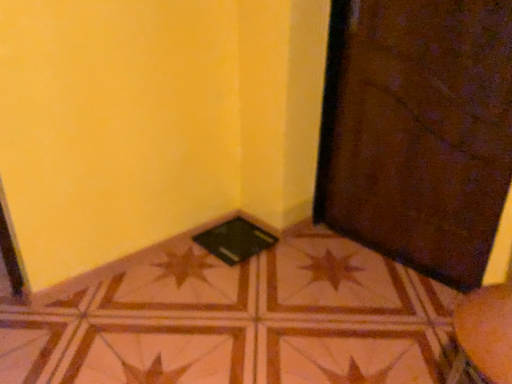
Question: Considering the relative sizes of brown glossy tile at center and black matte pad at lower center in the image provided, is brown glossy tile at center shorter than black matte pad at lower center?

Choices:
 (A) no
 (B) yes

Answer: (A)

Question: From a real-world perspective, is brown glossy tile at center on black matte pad at lower center?

Choices:
 (A) yes
 (B) no

Answer: (B)

Question: Does brown glossy tile at center have a smaller size compared to black matte pad at lower center?

Choices:
 (A) yes
 (B) no

Answer: (B)

Question: Considering the relative sizes of brown glossy tile at center and black matte pad at lower center in the image provided, is brown glossy tile at center bigger than black matte pad at lower center?

Choices:
 (A) yes
 (B) no

Answer: (A)

Question: From the image's perspective, is brown glossy tile at center beneath black matte pad at lower center?

Choices:
 (A) no
 (B) yes

Answer: (B)

Question: Based on their positions, is brown textured door at lower right located to the left or right of black matte pad at lower center?

Choices:
 (A) left
 (B) right

Answer: (B)

Question: From the image's perspective, is brown textured door at lower right above or below black matte pad at lower center?

Choices:
 (A) below
 (B) above

Answer: (B)

Question: Is brown textured door at lower right in front of or behind black matte pad at lower center in the image?

Choices:
 (A) behind
 (B) front

Answer: (B)

Question: Is brown textured door at lower right taller or shorter than black matte pad at lower center?

Choices:
 (A) short
 (B) tall

Answer: (B)

Question: In terms of height, does brown glossy tile at center look taller or shorter compared to brown textured door at lower right?

Choices:
 (A) tall
 (B) short

Answer: (B)

Question: From a real-world perspective, is brown glossy tile at center above or below brown textured door at lower right?

Choices:
 (A) below
 (B) above

Answer: (A)

Question: Considering the positions of brown glossy tile at center and brown textured door at lower right in the image, is brown glossy tile at center wider or thinner than brown textured door at lower right?

Choices:
 (A) thin
 (B) wide

Answer: (B)

Question: Would you say brown glossy tile at center is to the left or to the right of brown textured door at lower right in the picture?

Choices:
 (A) right
 (B) left

Answer: (B)

Question: From the image's perspective, relative to black matte pad at lower center, is brown glossy tile at center above or below?

Choices:
 (A) above
 (B) below

Answer: (B)

Question: Considering the positions of point (32, 329) and point (216, 251), is point (32, 329) closer or farther from the camera than point (216, 251)?

Choices:
 (A) farther
 (B) closer

Answer: (B)